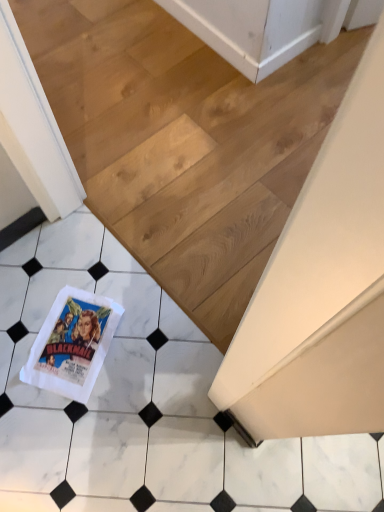
At what (x,y) coordinates should I click in order to perform the action: click on vacant space that is to the left of white paper towel at lower left. Please return your answer as a coordinate pair (x, y). Looking at the image, I should click on click(20, 327).